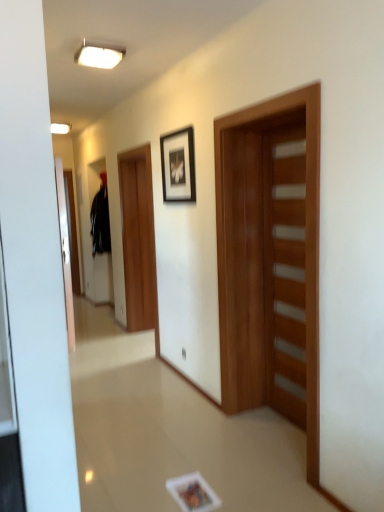
This screenshot has height=512, width=384. Describe the element at coordinates (285, 271) in the screenshot. I see `wooden door at right, which ranks as the 2th door in left-to-right order` at that location.

Locate an element on the screen. black matte sweatshirt at left is located at coordinates 100,222.

Where is `wooden door at right, which ranks as the 2th door in left-to-right order`? wooden door at right, which ranks as the 2th door in left-to-right order is located at coordinates (285, 271).

From the image's perspective, is wooden door at center, which is the 2th door from right to left, on white glossy ceiling light at upper center?

No, from the image's perspective, wooden door at center, which is the 2th door from right to left, is not above white glossy ceiling light at upper center.

Can you confirm if wooden door at center, marked as the 1th door in a left-to-right arrangement, is taller than white glossy ceiling light at upper center?

Yes.

Which is less distant, [222,375] or [78,61]?

The point [222,375] is closer to the camera.

Are wooden door at center, marked as the 1th door in a left-to-right arrangement, and white glossy ceiling light at upper center making contact?

There is a gap between wooden door at center, marked as the 1th door in a left-to-right arrangement, and white glossy ceiling light at upper center.

How many degrees apart are the facing directions of black matte picture frame at upper center and wooden door at center, which is the 2th door from right to left?

They differ by 0.45 degrees in their facing directions.

In terms of width, does black matte picture frame at upper center look wider or thinner when compared to wooden door at center, which is the 2th door from right to left?

Clearly, black matte picture frame at upper center has less width compared to wooden door at center, which is the 2th door from right to left.

Is black matte picture frame at upper center with wooden door at center, which is the 2th door from right to left?

There is a gap between black matte picture frame at upper center and wooden door at center, which is the 2th door from right to left.

In the scene shown: How much distance is there between black matte picture frame at upper center and wooden door at center, marked as the 1th door in a left-to-right arrangement?

31.41 inches.

Is white glossy ceiling light at upper center aimed at wooden door at right, marked as the first door in a right-to-left arrangement?

No, white glossy ceiling light at upper center is not facing towards wooden door at right, marked as the first door in a right-to-left arrangement.

Does white glossy ceiling light at upper center have a lesser height compared to wooden door at right, which ranks as the 2th door in left-to-right order?

Indeed, white glossy ceiling light at upper center has a lesser height compared to wooden door at right, which ranks as the 2th door in left-to-right order.

From the picture: Is white glossy ceiling light at upper center completely or partially outside of wooden door at right, marked as the first door in a right-to-left arrangement?

white glossy ceiling light at upper center is positioned outside wooden door at right, marked as the first door in a right-to-left arrangement.

Between white glossy ceiling light at upper center and wooden door at right, which ranks as the 2th door in left-to-right order, which one has larger width?

white glossy ceiling light at upper center is wider.

In the scene shown: From a real-world perspective, is white glossy ceiling light at upper center positioned above or below black matte picture frame at upper center?

From a real-world perspective, white glossy ceiling light at upper center is physically above black matte picture frame at upper center.

Would you consider white glossy ceiling light at upper center to be distant from black matte picture frame at upper center?

white glossy ceiling light at upper center is actually quite close to black matte picture frame at upper center.

Is white glossy ceiling light at upper center closer to camera compared to black matte picture frame at upper center?

Yes, the depth of white glossy ceiling light at upper center is less than that of black matte picture frame at upper center.

From a real-world perspective, who is located higher, black matte sweatshirt at left or wooden door at center, which is the 2th door from right to left?

black matte sweatshirt at left, from a real-world perspective.

Is black matte sweatshirt at left to the left of wooden door at center, marked as the 1th door in a left-to-right arrangement, from the viewer's perspective?

Indeed, black matte sweatshirt at left is positioned on the left side of wooden door at center, marked as the 1th door in a left-to-right arrangement.

Identify the location of the 1st door to the right of the black matte sweatshirt at left, starting your count from the anchor. This screenshot has height=512, width=384. (306, 220).

From the image's perspective, is black matte sweatshirt at left on top of wooden door at center, marked as the 1th door in a left-to-right arrangement?

Yes, from the image's perspective, black matte sweatshirt at left is on top of wooden door at center, marked as the 1th door in a left-to-right arrangement.

Between point (94, 241) and point (98, 56), which one is positioned in front?

Point (98, 56)

Consider the image. Does black matte sweatshirt at left have a greater height compared to white glossy ceiling light at upper center?

Yes.

Which is in front, black matte sweatshirt at left or white glossy ceiling light at upper center?

white glossy ceiling light at upper center is closer to the camera.

Is wooden door at center, which is the 2th door from right to left, outside of wooden door at right, which ranks as the 2th door in left-to-right order?

Yes.

From the image's perspective, would you say wooden door at center, marked as the 1th door in a left-to-right arrangement, is shown under wooden door at right, marked as the first door in a right-to-left arrangement?

No, from the image's perspective, wooden door at center, marked as the 1th door in a left-to-right arrangement, is not beneath wooden door at right, marked as the first door in a right-to-left arrangement.

Which object is more forward, wooden door at center, which is the 2th door from right to left, or wooden door at right, which ranks as the 2th door in left-to-right order?

wooden door at center, which is the 2th door from right to left, is in front.

Does wooden door at center, which is the 2th door from right to left, have a lesser height compared to wooden door at right, marked as the first door in a right-to-left arrangement?

No.

This screenshot has width=384, height=512. I want to click on light fixture that is above the wooden door at center, marked as the 1th door in a left-to-right arrangement (from a real-world perspective), so click(x=99, y=55).

Starting from the black matte picture frame at upper center, which door is the 2nd one in front? Please provide its 2D coordinates.

[(306, 220)]

When comparing their distances from wooden door at right, marked as the first door in a right-to-left arrangement, does white glossy ceiling light at upper center or black matte picture frame at upper center seem closer?

black matte picture frame at upper center is positioned closer to the anchor wooden door at right, marked as the first door in a right-to-left arrangement.

Which object lies nearer to the anchor point black matte sweatshirt at left, white glossy ceiling light at upper center or wooden door at right, marked as the first door in a right-to-left arrangement?

Based on the image, white glossy ceiling light at upper center appears to be nearer to black matte sweatshirt at left.

When comparing their distances from white glossy ceiling light at upper center, does wooden door at right, marked as the first door in a right-to-left arrangement, or black matte sweatshirt at left seem closer?

Based on the image, wooden door at right, marked as the first door in a right-to-left arrangement, appears to be nearer to white glossy ceiling light at upper center.

Estimate the real-world distances between objects in this image. Which object is closer to wooden door at center, marked as the 1th door in a left-to-right arrangement, wooden door at right, marked as the first door in a right-to-left arrangement, or black matte picture frame at upper center?

wooden door at right, marked as the first door in a right-to-left arrangement, is positioned closer to the anchor wooden door at center, marked as the 1th door in a left-to-right arrangement.

Estimate the real-world distances between objects in this image. Which object is closer to wooden door at right, marked as the first door in a right-to-left arrangement, black matte sweatshirt at left or black matte picture frame at upper center?

black matte picture frame at upper center.

Consider the image. Looking at the image, which one is located further to black matte picture frame at upper center, white glossy ceiling light at upper center or black matte sweatshirt at left?

Among the two, black matte sweatshirt at left is located further to black matte picture frame at upper center.

Based on their spatial positions, is white glossy ceiling light at upper center or black matte picture frame at upper center further from black matte sweatshirt at left?

white glossy ceiling light at upper center is further to black matte sweatshirt at left.

Based on their spatial positions, is wooden door at center, marked as the 1th door in a left-to-right arrangement, or black matte picture frame at upper center further from white glossy ceiling light at upper center?

The object further to white glossy ceiling light at upper center is wooden door at center, marked as the 1th door in a left-to-right arrangement.

At what (x,y) coordinates should I click in order to perform the action: click on picture frame that lies between white glossy ceiling light at upper center and wooden door at center, which is the 2th door from right to left, from top to bottom. Please return your answer as a coordinate pair (x, y). The image size is (384, 512). Looking at the image, I should click on (178, 166).

The height and width of the screenshot is (512, 384). What are the coordinates of `picture frame between white glossy ceiling light at upper center and wooden door at right, which ranks as the 2th door in left-to-right order, vertically` in the screenshot? It's located at (178, 166).

Image resolution: width=384 pixels, height=512 pixels. Find the location of `picture frame located between wooden door at center, which is the 2th door from right to left, and black matte sweatshirt at left in the depth direction`. picture frame located between wooden door at center, which is the 2th door from right to left, and black matte sweatshirt at left in the depth direction is located at coordinates (178, 166).

At what (x,y) coordinates should I click in order to perform the action: click on door between wooden door at center, which is the 2th door from right to left, and black matte sweatshirt at left in the front-back direction. Please return your answer as a coordinate pair (x, y). Looking at the image, I should click on (285, 271).